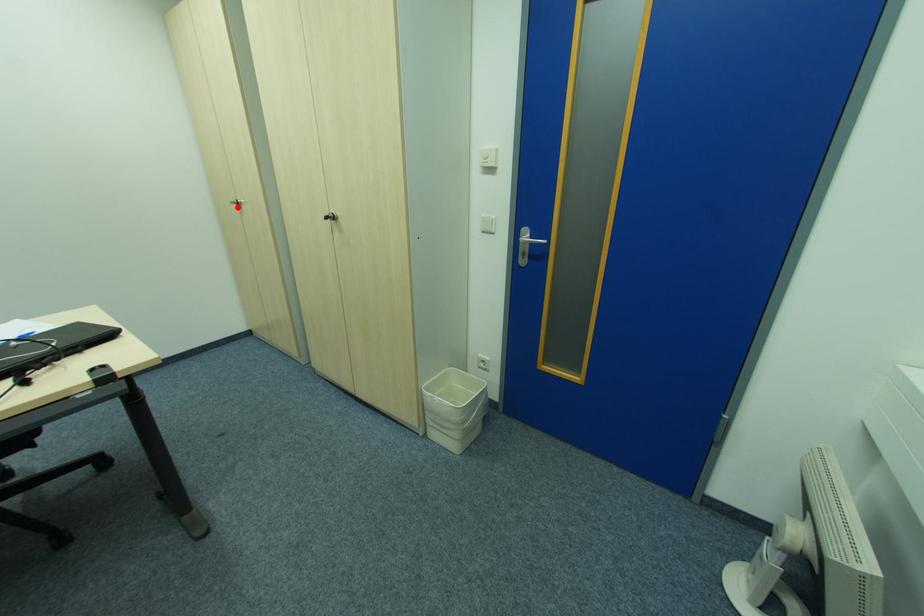
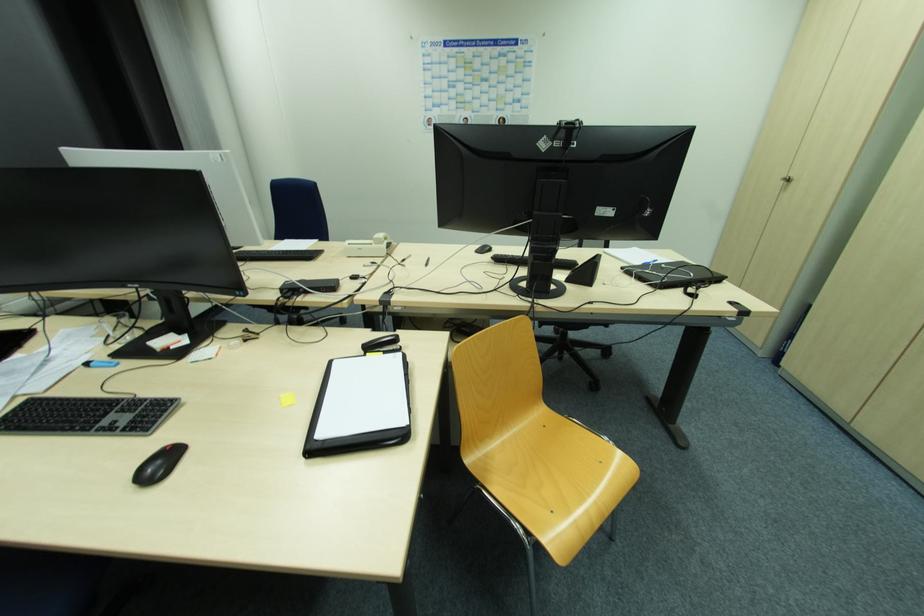
Locate, in the second image, the point that corresponds to the highlighted location in the first image.

(784, 183)